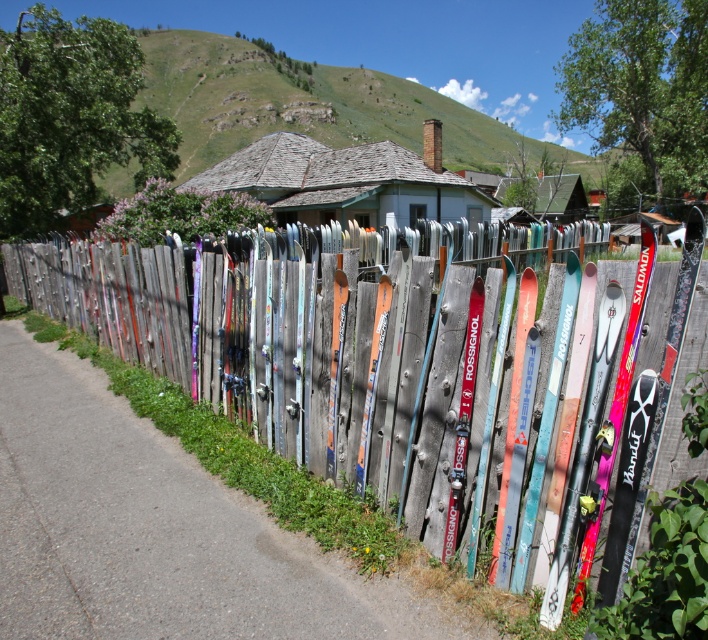
Who is lower down, wooden skis at center or gray shingled house at center?

wooden skis at center is lower down.

Does point (474, 493) come closer to viewer compared to point (396, 225)?

That is True.

Locate an element on the screen. This screenshot has height=640, width=708. wooden skis at center is located at coordinates (382, 362).